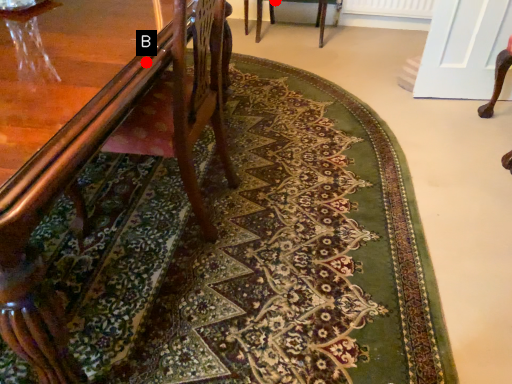
Question: Two points are circled on the image, labeled by A and B beside each circle. Which point is further to the camera?

Choices:
 (A) A is further
 (B) B is further

Answer: (A)